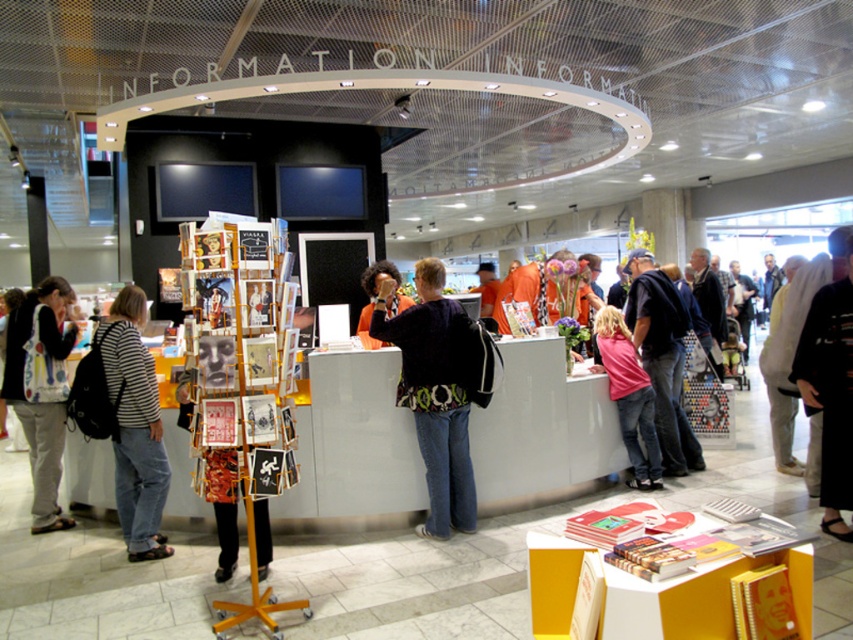
Question: Which object is the farthest from the printed fabric bag at left?

Choices:
 (A) striped cotton shirt at left
 (B) pink fabric shirt at center
 (C) black kimono at center

Answer: (C)

Question: Does striped cotton shirt at left have a greater width compared to dark blue jeans at center?

Choices:
 (A) no
 (B) yes

Answer: (A)

Question: Among these objects, which one is nearest to the camera?

Choices:
 (A) orange fabric shirt at center
 (B) dark blue jeans at center
 (C) black kimono at center
 (D) pink fabric shirt at center

Answer: (C)

Question: Is black kimono at center thinner than pink fabric shirt at center?

Choices:
 (A) no
 (B) yes

Answer: (A)

Question: Among these objects, which one is farthest from the camera?

Choices:
 (A) dark blue jeans at center
 (B) dark blue sweater at center
 (C) pink fabric shirt at center

Answer: (A)

Question: Is striped cotton shirt at left smaller than printed fabric bag at left?

Choices:
 (A) no
 (B) yes

Answer: (B)